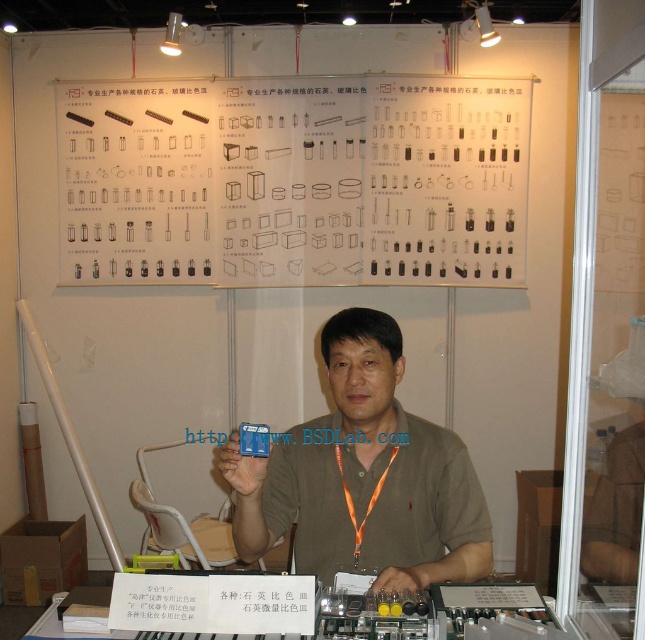
Question: Which point is closer to the camera?

Choices:
 (A) (410, 205)
 (B) (357, 355)
 (C) (250, 632)

Answer: (C)

Question: Which object is closer to the camera taking this photo?

Choices:
 (A) matte blue card at center
 (B) white paper at upper center
 (C) translucent plastic tubes at lower center

Answer: (C)

Question: Where is white paper at upper center located in relation to matte blue card at center in the image?

Choices:
 (A) right
 (B) left

Answer: (B)

Question: Is white paper at upper center positioned before translucent plastic tubes at lower center?

Choices:
 (A) no
 (B) yes

Answer: (A)

Question: Which of the following is the farthest from the observer?

Choices:
 (A) matte blue card at center
 (B) translucent plastic tubes at lower center
 (C) white paper at upper center

Answer: (C)

Question: Does white paper at upper center appear on the left side of translucent plastic tubes at lower center?

Choices:
 (A) no
 (B) yes

Answer: (B)